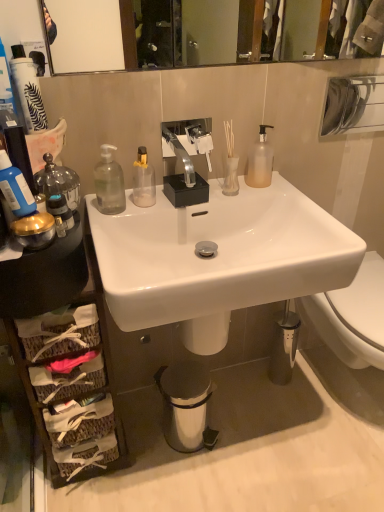
In order to face blue matte bottle at left, the third bottle when ordered from right to left, should I rotate leftwards or rightwards?

Turn left approximately 22.559 degrees to face it.

Describe the element at coordinates (218, 258) in the screenshot. I see `white glossy sink at center, acting as the first sink starting from the bottom` at that location.

Measure the distance between transparent plastic bottle at left, which is counted as the second bottle, starting from the left, and camera.

The depth of transparent plastic bottle at left, which is counted as the second bottle, starting from the left, is 1.10 meters.

In order to face frosted glass pump bottle at upper right, the first bottle from the back, should I rotate leftwards or rightwards?

A 9.357 degree turn to the right will do.

This screenshot has height=512, width=384. Describe the element at coordinates (260, 161) in the screenshot. I see `frosted glass pump bottle at upper right, the first bottle from the back` at that location.

At what (x,y) coordinates should I click in order to perform the action: click on woven wood basket at lower left. Please return your answer as a coordinate pair (x, y). Looking at the image, I should click on (107, 373).

Identify the location of blue matte bottle at left, which is the first bottle from front to back. Image resolution: width=384 pixels, height=512 pixels. (15, 188).

Are translucent glass vase at upper center and white glossy sink at center, acting as the first sink starting from the bottom, located far from each other?

Actually, translucent glass vase at upper center and white glossy sink at center, acting as the first sink starting from the bottom, are a little close together.

From the image's perspective, is translucent glass vase at upper center on top of white glossy sink at center, acting as the first sink starting from the bottom?

Yes, from the image's perspective, translucent glass vase at upper center is on top of white glossy sink at center, acting as the first sink starting from the bottom.

From a real-world perspective, between translucent glass vase at upper center and white glossy sink at center, which is the 2th sink from top to bottom, who is vertically higher?

translucent glass vase at upper center is physically above.

In the scene shown: Which of these two, translucent glass vase at upper center or metallic trash can at lower center, is bigger?

Bigger between the two is metallic trash can at lower center.

Where is `trash bin/can behind the translucent glass vase at upper center`? This screenshot has width=384, height=512. trash bin/can behind the translucent glass vase at upper center is located at coordinates (186, 406).

Is the depth of white frosted glass vase at upper center less than that of frosted glass pump bottle at upper right, which ranks as the first bottle in right-to-left order?

Yes, white frosted glass vase at upper center is closer to the camera.

Is white frosted glass vase at upper center bigger than frosted glass pump bottle at upper right, the first bottle from the back?

No.

Is white frosted glass vase at upper center turned away from frosted glass pump bottle at upper right, the third bottle positioned from the front?

No, frosted glass pump bottle at upper right, the third bottle positioned from the front, is not at the back of white frosted glass vase at upper center.

In the scene shown: Considering the positions of objects white frosted glass vase at upper center and frosted glass pump bottle at upper right, the first bottle from the back, in the image provided, who is more to the left, white frosted glass vase at upper center or frosted glass pump bottle at upper right, the first bottle from the back,?

Positioned to the left is white frosted glass vase at upper center.

In the scene shown: From a real-world perspective, between white glossy sink at center, which is the 2th sink from top to bottom, and woven wood basket at lower left, who is vertically higher?

In real-world perspective, white glossy sink at center, which is the 2th sink from top to bottom, is above.

Could you measure the distance between white glossy sink at center, acting as the first sink starting from the bottom, and woven wood basket at lower left?

white glossy sink at center, acting as the first sink starting from the bottom, is 13.18 inches from woven wood basket at lower left.

Which of these two, white glossy sink at center, acting as the first sink starting from the bottom, or woven wood basket at lower left, is thinner?

Thinner between the two is woven wood basket at lower left.

Is point (234, 243) closer or farther from the camera than point (120, 455)?

Point (234, 243) is closer to the camera than point (120, 455).

From a real-world perspective, is blue matte bottle at left, which ranks as the 3th bottle in back-to-front order, physically above woven wood basket at lower left?

Correct, in the physical world, blue matte bottle at left, which ranks as the 3th bottle in back-to-front order, is higher than woven wood basket at lower left.

Is the position of blue matte bottle at left, the third bottle when ordered from right to left, more distant than that of woven wood basket at lower left?

No, blue matte bottle at left, the third bottle when ordered from right to left, is closer to the camera.

Is blue matte bottle at left, the third bottle when ordered from right to left, positioned beyond the bounds of woven wood basket at lower left?

blue matte bottle at left, the third bottle when ordered from right to left, is positioned outside woven wood basket at lower left.

Between point (25, 180) and point (110, 471), which one is positioned in front?

The point (25, 180) is closer.

Is polished chrome faucet at center, which is the first sink in top-to-bottom order, not close to metallic trash can at lower center?

Actually, polished chrome faucet at center, which is the first sink in top-to-bottom order, and metallic trash can at lower center are a little close together.

How different are the orientations of polished chrome faucet at center, which is the first sink in top-to-bottom order, and metallic trash can at lower center in degrees?

They differ by 15.7 degrees in their facing directions.

Which of these two, polished chrome faucet at center, which is the first sink in top-to-bottom order, or metallic trash can at lower center, stands shorter?

polished chrome faucet at center, which is the first sink in top-to-bottom order, is shorter.

Where is `trash bin/can on the left side of polished chrome faucet at center, the 2th sink positioned from the bottom`? trash bin/can on the left side of polished chrome faucet at center, the 2th sink positioned from the bottom is located at coordinates (186, 406).

Which point is more forward, (191,202) or (223,188)?

Positioned in front is point (191,202).

How different are the orientations of polished chrome faucet at center, the 2th sink positioned from the bottom, and translucent glass vase at upper center in degrees?

They differ by 2.61 degrees in their facing directions.

From the picture: From the image's perspective, which is below, polished chrome faucet at center, which is the first sink in top-to-bottom order, or translucent glass vase at upper center?

translucent glass vase at upper center appears lower in the image.

The height and width of the screenshot is (512, 384). In order to click on sink below the translucent glass vase at upper center (from a real-world perspective) in this screenshot , I will do `click(218, 258)`.

Find the location of a particular element. toilet paper in front of the metallic trash can at lower center is located at coordinates 231,177.

Based on their spatial positions, is white glossy sink at center, acting as the first sink starting from the bottom, or metallic trash can at lower center further from frosted glass pump bottle at upper right, the first bottle from the back?

The object further to frosted glass pump bottle at upper right, the first bottle from the back, is metallic trash can at lower center.

When comparing their distances from frosted glass pump bottle at upper right, which is counted as the 3th bottle, starting from the left, does translucent glass vase at upper center or white frosted glass vase at upper center seem closer?

translucent glass vase at upper center lies closer to frosted glass pump bottle at upper right, which is counted as the 3th bottle, starting from the left, than the other object.

Which object lies further to the anchor point translucent glass vase at upper center, white glossy sink at center, acting as the first sink starting from the bottom, or woven wood basket at lower left?

Among the two, woven wood basket at lower left is located further to translucent glass vase at upper center.

Which object lies further to the anchor point frosted glass pump bottle at upper right, which is counted as the 3th bottle, starting from the left, white glossy sink at center, which is the 2th sink from top to bottom, or woven wood basket at lower left?

woven wood basket at lower left.

Based on their spatial positions, is white frosted glass vase at upper center or frosted glass pump bottle at upper right, which is counted as the 3th bottle, starting from the left, further from metallic trash can at lower center?

Among the two, frosted glass pump bottle at upper right, which is counted as the 3th bottle, starting from the left, is located further to metallic trash can at lower center.

Estimate the real-world distances between objects in this image. Which object is further from metallic trash can at lower center, blue matte bottle at left, placed as the 1th bottle when sorted from left to right, or white frosted glass vase at upper center?

Among the two, blue matte bottle at left, placed as the 1th bottle when sorted from left to right, is located further to metallic trash can at lower center.

Estimate the real-world distances between objects in this image. Which object is further from transparent plastic bottle at left, which is the second bottle in right-to-left order, white glossy sink at center, acting as the first sink starting from the bottom, or frosted glass pump bottle at upper right, the third bottle positioned from the front?

Based on the image, frosted glass pump bottle at upper right, the third bottle positioned from the front, appears to be further to transparent plastic bottle at left, which is the second bottle in right-to-left order.

When comparing their distances from blue matte bottle at left, which is the first bottle from front to back, does frosted glass pump bottle at upper right, the first bottle from the back, or white frosted glass vase at upper center seem further?

Among the two, frosted glass pump bottle at upper right, the first bottle from the back, is located further to blue matte bottle at left, which is the first bottle from front to back.

Locate an element on the screen. The height and width of the screenshot is (512, 384). bottle located between blue matte bottle at left, which is the first bottle from front to back, and polished chrome faucet at center, which is the first sink in top-to-bottom order, in the left-right direction is located at coordinates (109, 183).

You are a GUI agent. You are given a task and a screenshot of the screen. Output one action in this format:
    pyautogui.click(x=<x>, y=<y>)
    Task: Click on the sink between frosted glass pump bottle at upper right, which is counted as the 3th bottle, starting from the left, and white glossy sink at center, acting as the first sink starting from the bottom, from top to bottom
    
    Given the screenshot: What is the action you would take?
    pyautogui.click(x=186, y=160)

The image size is (384, 512). In order to click on toilet paper between white frosted glass vase at upper center and frosted glass pump bottle at upper right, which is counted as the 3th bottle, starting from the left, in the horizontal direction in this screenshot , I will do `click(231, 177)`.

Locate an element on the screen. sink between polished chrome faucet at center, the 2th sink positioned from the bottom, and woven wood basket at lower left, in the vertical direction is located at coordinates (218, 258).